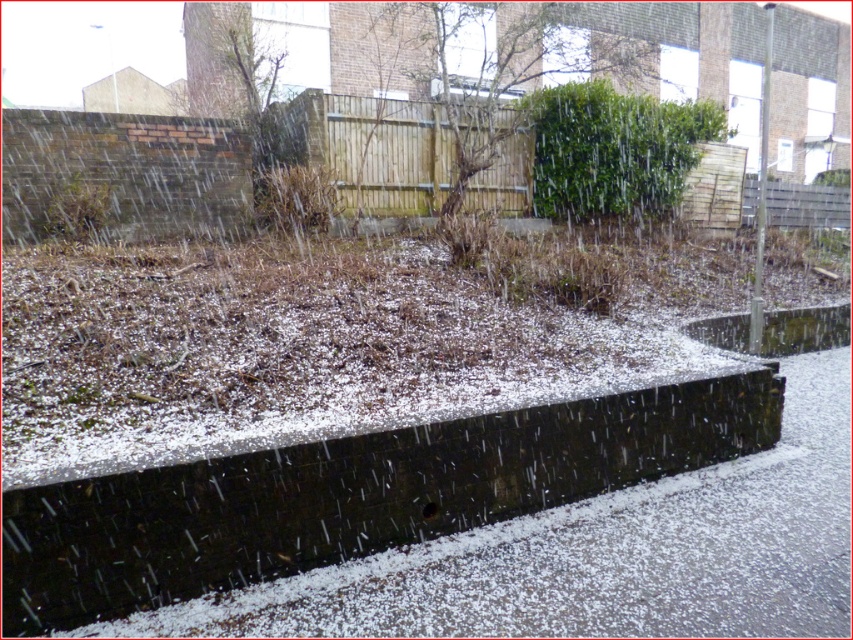
In the scene shown: You are standing at the edge of the garden bed and want to walk to the driveway. Which object must you pass by first, the black concrete curb at lower center or the green leafy bush at upper center?

You must pass by the black concrete curb at lower center first because it is located below the green leafy bush at upper center, meaning it is closer to your starting position at the garden bed.

You are standing at the edge of the garden bed and want to walk to the paved pathway. You see the black concrete curb at lower center and the green leafy bush at upper center. Which object should you avoid stepping on to reach the pathway safely?

You should avoid stepping on the green leafy bush at upper center because the black concrete curb at lower center is to the left of it, meaning the pathway is likely near the curb which is closer to your starting position at the garden bed edge.

You are standing at the edge of the black concrete curb at lower center and want to walk towards the green leafy tree at upper center. Which direction should you move to reach the tree?

You should move upward towards the green leafy tree at upper center since the black concrete curb at lower center is located below it.